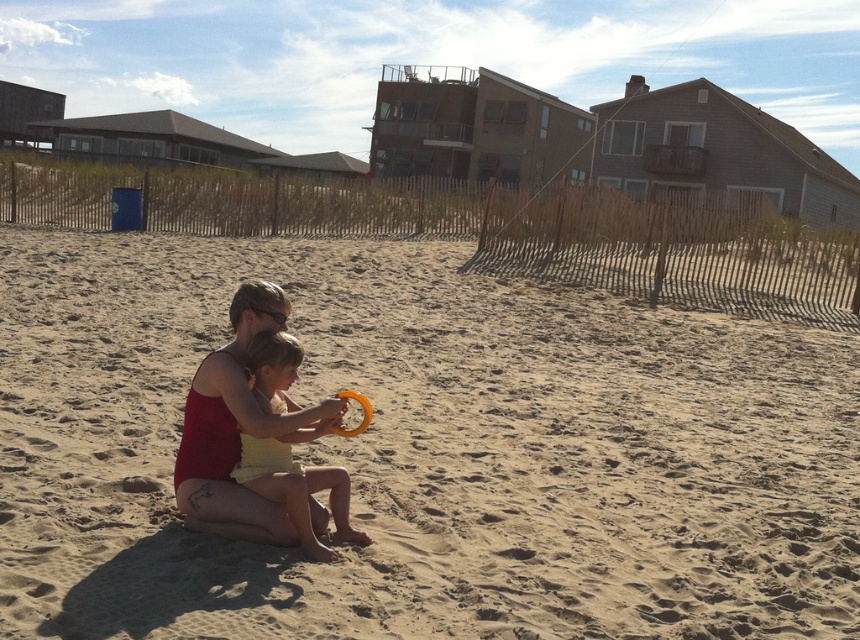
Question: Which object appears closest to the camera in this image?

Choices:
 (A) light brown sand at center
 (B) yellow fabric at center

Answer: (A)

Question: Is yellow fabric at center smaller than orange rubber ring at center?

Choices:
 (A) yes
 (B) no

Answer: (B)

Question: Is light brown sand at center behind orange rubber ring at center?

Choices:
 (A) yes
 (B) no

Answer: (B)

Question: Is yellow fabric at center further to camera compared to orange rubber ring at center?

Choices:
 (A) no
 (B) yes

Answer: (A)

Question: Which of the following is the closest to the observer?

Choices:
 (A) orange rubber ring at center
 (B) yellow fabric at center
 (C) light brown sand at center

Answer: (C)

Question: Which point is farther to the camera?

Choices:
 (A) (249, 461)
 (B) (584, 577)

Answer: (B)